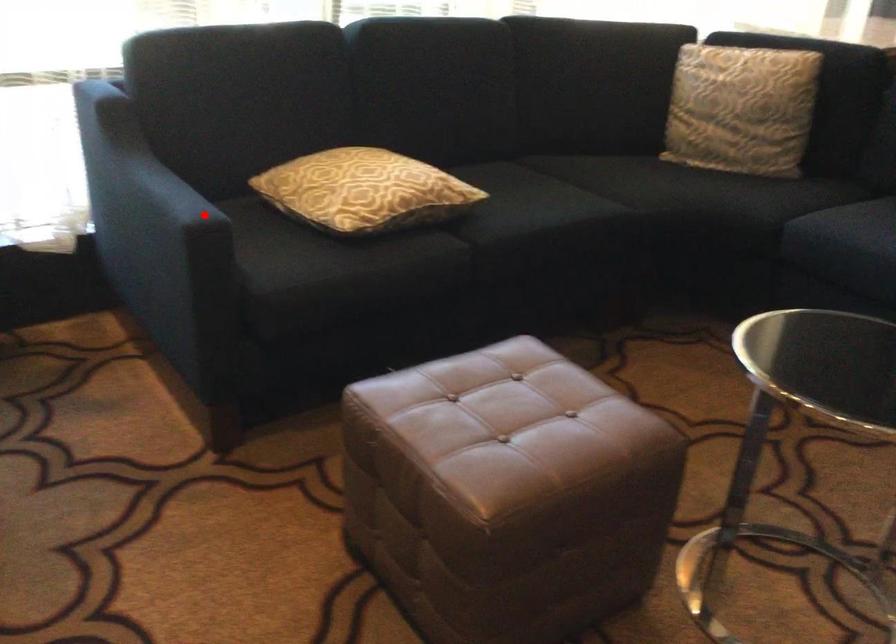
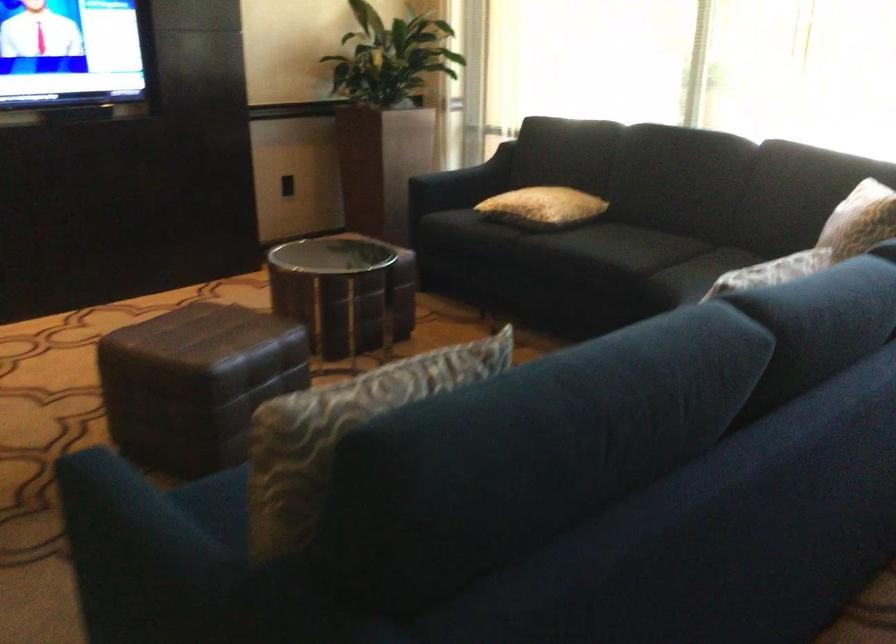
Where in the second image is the point corresponding to the highlighted location from the first image?

(460, 184)